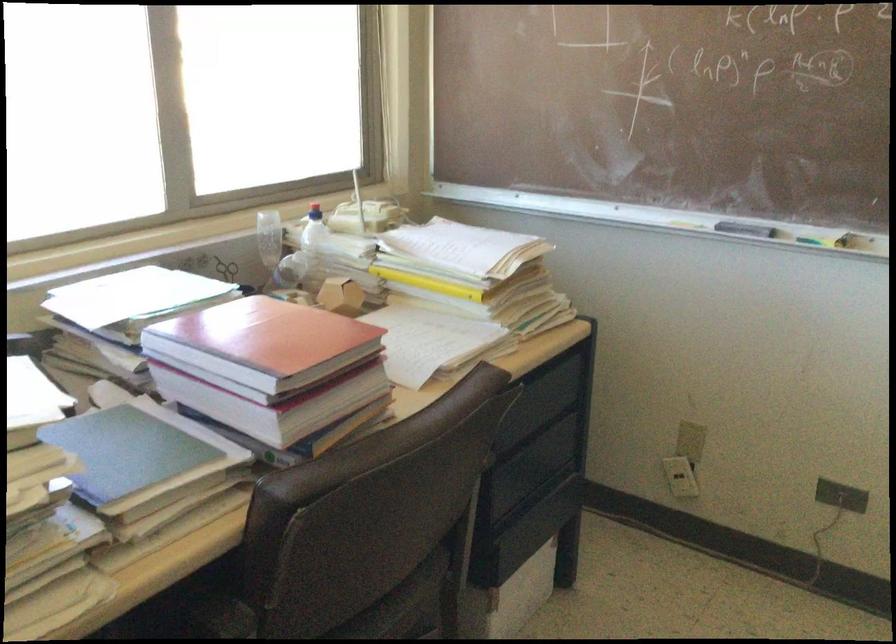
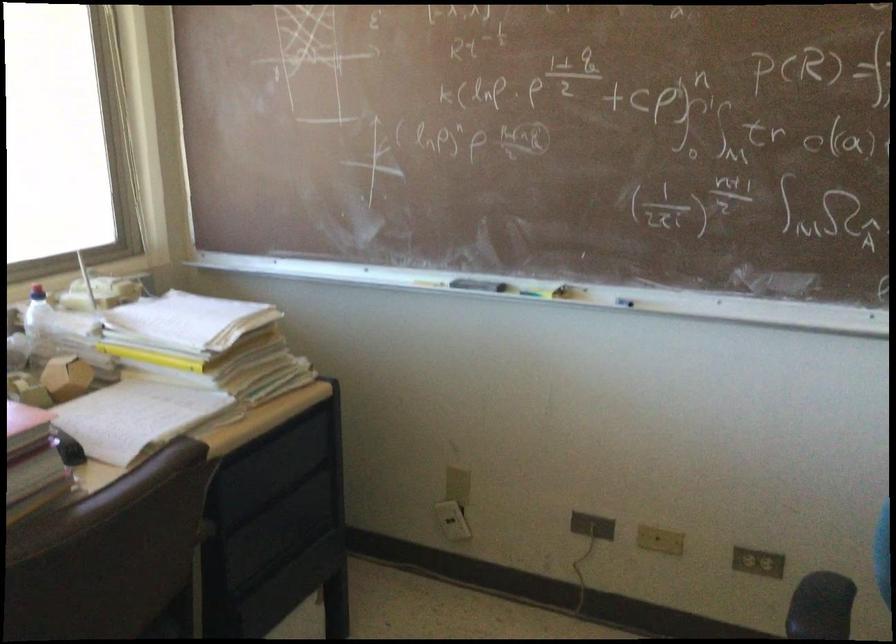
Find the pixel in the second image that matches pixel 684 468 in the first image.

(452, 520)